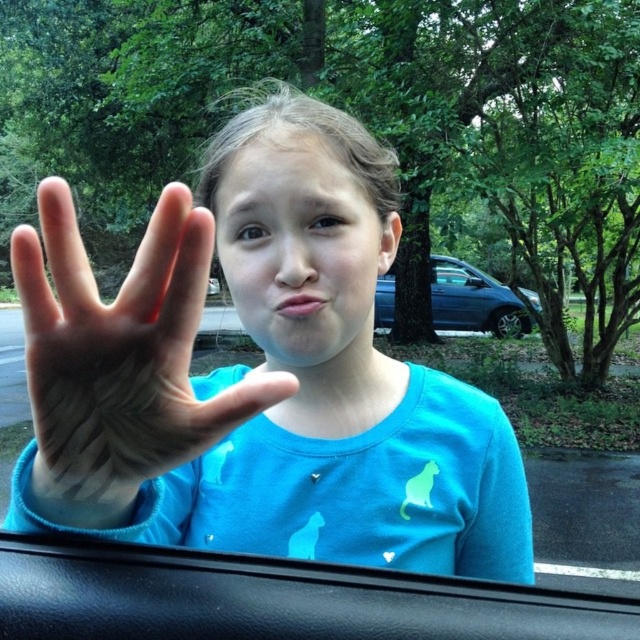
You are a photographer trying to capture the girl in the image. The camera focuses on the center point of the image. Is the matte blue shirt at center in focus?

The matte blue shirt at center is located at point (259, 372), which is close to the center of the image, so it should be in focus.

You are a photographer trying to capture a closeup of the matte blue shirt at center and the matte skin hand at center in the scene. The camera you are using has a minimum focus distance of 4 inches. Can you focus on both subjects simultaneously?

The matte blue shirt at center and matte skin hand at center are 4.24 inches apart from each other. Since the camera can focus as close as 4 inches, it can capture both subjects at once because the distance between them is within the focus range.

You are a delivery person trying to load a box that is 2 meters wide into the space between the black leather car door at lower center and the blue metallic car at center. Based on the scene, can the box fit?

The black leather car door at lower center has a lesser width compared to blue metallic car at center. Since the box is 2 meters wide, the space between them may not be sufficient to accommodate it, as the car door is narrower than the car itself.